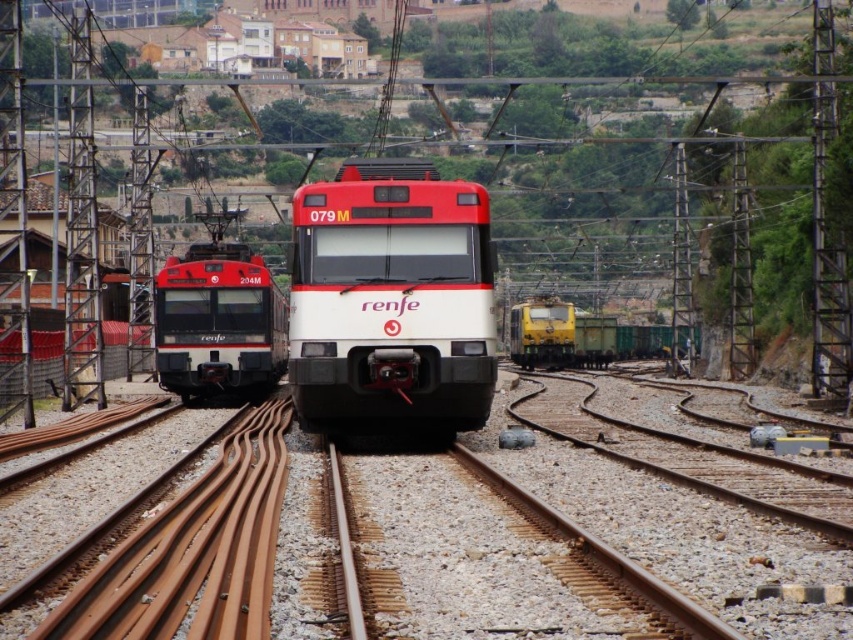
Question: Which object appears closest to the camera in this image?

Choices:
 (A) white glossy train at center
 (B) matte black train at left
 (C) yellow matte train at right

Answer: (A)

Question: Can you confirm if white glossy train at center is bigger than yellow matte train at right?

Choices:
 (A) yes
 (B) no

Answer: (B)

Question: Which of the following is the farthest from the observer?

Choices:
 (A) yellow matte train at right
 (B) white glossy train at center

Answer: (A)

Question: Does white glossy train at center appear over matte black train at left?

Choices:
 (A) yes
 (B) no

Answer: (A)

Question: Which point appears farthest from the camera in this image?

Choices:
 (A) (469, 372)
 (B) (569, 348)
 (C) (167, 332)

Answer: (B)

Question: Is matte black train at left wider than yellow matte train at right?

Choices:
 (A) no
 (B) yes

Answer: (A)